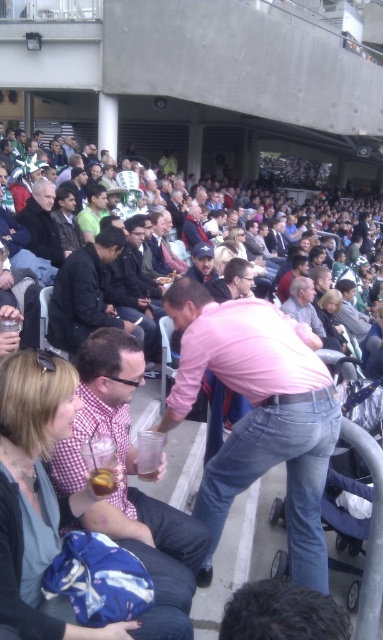
Question: Can you confirm if checkered fabric shirt at center is wider than dark brown leather jacket at upper left?

Choices:
 (A) yes
 (B) no

Answer: (A)

Question: Which object appears closest to the camera in this image?

Choices:
 (A) dark brown leather jacket at upper left
 (B) dark blue jacket at center

Answer: (B)

Question: Is dark blue jacket at center smaller than dark brown leather jacket at upper left?

Choices:
 (A) no
 (B) yes

Answer: (A)

Question: Considering the real-world distances, which object is farthest from the dark blue jacket at center?

Choices:
 (A) checkered fabric shirt at center
 (B) dark brown leather jacket at upper left

Answer: (A)

Question: Based on their relative distances, which object is farther from the dark blue jacket at center?

Choices:
 (A) checkered fabric shirt at center
 (B) dark brown leather jacket at upper left

Answer: (A)

Question: Does checkered fabric shirt at center come in front of dark brown leather jacket at upper left?

Choices:
 (A) no
 (B) yes

Answer: (B)